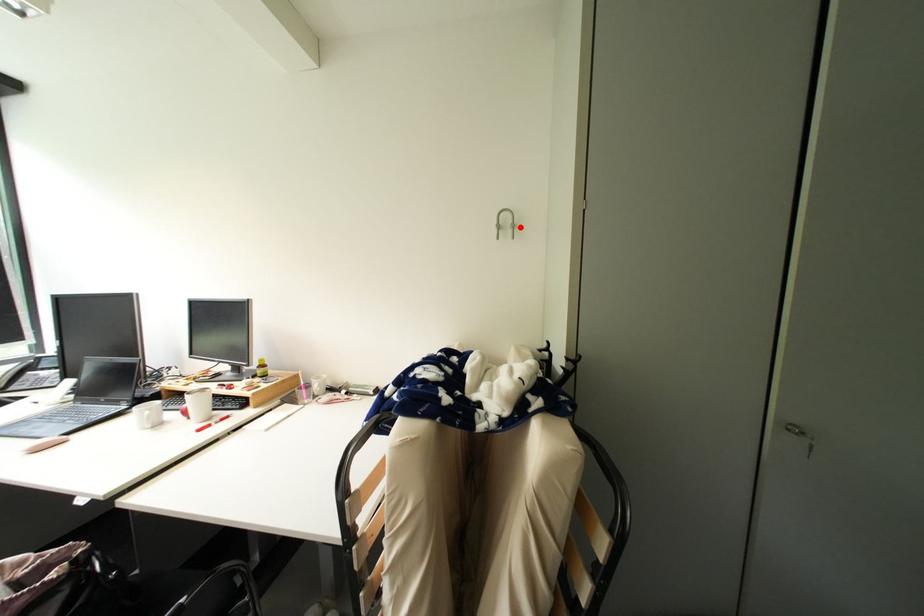
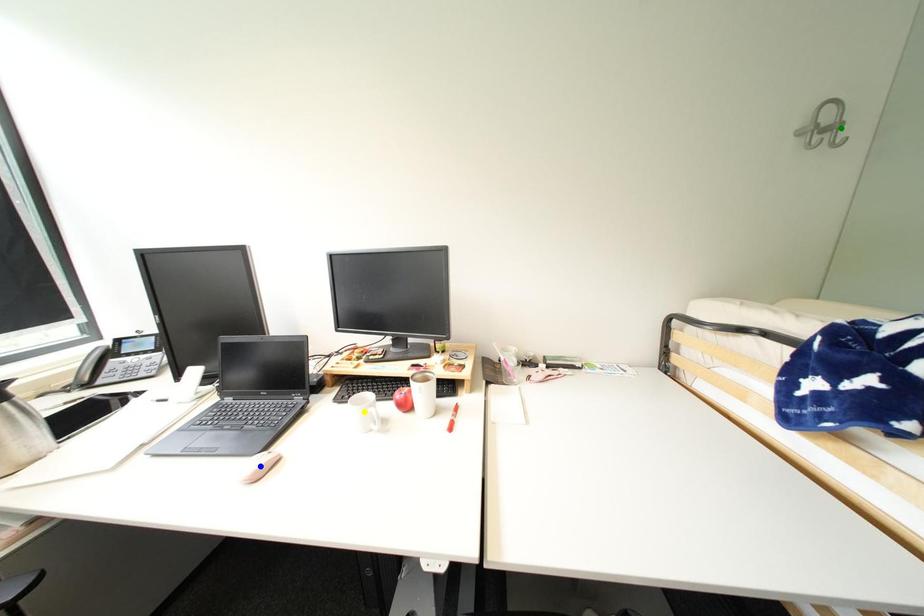
Question: I am providing you with two images of the same scene from different viewpoints. A red point is marked on the first image. You are given multiple points on the second image. Which point in image 2 is actually the same real-world point as the red point in image 1?

Choices:
 (A) green point
 (B) yellow point
 (C) blue point

Answer: (A)